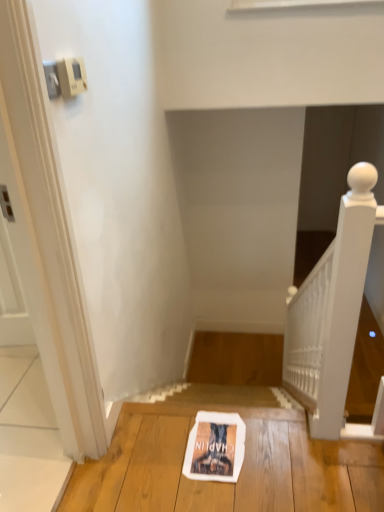
You are a GUI agent. You are given a task and a screenshot of the screen. Output one action in this format:
    pyautogui.click(x=<x>, y=<y>)
    Task: Click on the free location above white paper flyer at center (from a real-world perspective)
    This screenshot has height=512, width=384.
    Given the screenshot: What is the action you would take?
    pyautogui.click(x=212, y=435)